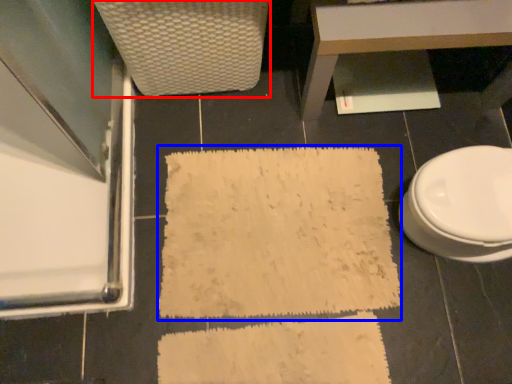
Question: Which of the following is the farthest to the observer, armchair (highlighted by a red box) or bath mat (highlighted by a blue box)?

Choices:
 (A) armchair
 (B) bath mat

Answer: (B)